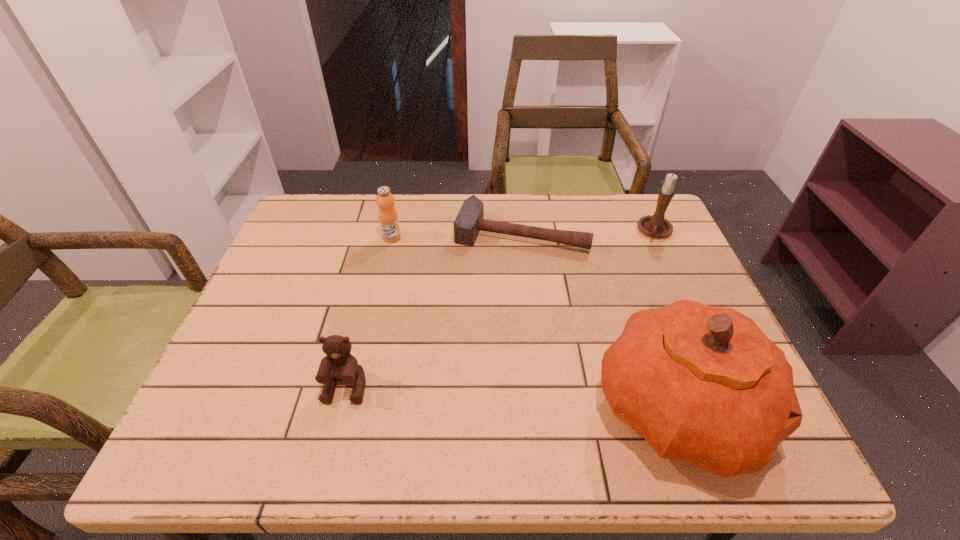
Image resolution: width=960 pixels, height=540 pixels. I want to click on free space located on the front label of the orange juice, so click(x=451, y=303).

Where is `vacant area situated on the striking surface of the shortest object`? vacant area situated on the striking surface of the shortest object is located at coordinates (471, 367).

Find the location of `free spot located 0.080m on the striking surface of the shortest object`. free spot located 0.080m on the striking surface of the shortest object is located at coordinates (500, 274).

Locate an element on the screen. Image resolution: width=960 pixels, height=540 pixels. blank area located 0.260m on the striking surface of the shortest object is located at coordinates (484, 326).

I want to click on candle holder located in the far edge section of the desktop, so click(x=656, y=226).

Where is `orange juice situated at the far edge`? orange juice situated at the far edge is located at coordinates (388, 218).

What are the coordinates of `hammer at the far edge` in the screenshot? It's located at (470, 220).

Where is `teddy bear located at the near edge`? This screenshot has height=540, width=960. teddy bear located at the near edge is located at coordinates (339, 365).

The height and width of the screenshot is (540, 960). Identify the location of pumpkin at the near edge. (702, 384).

I want to click on pumpkin at the right edge, so click(702, 384).